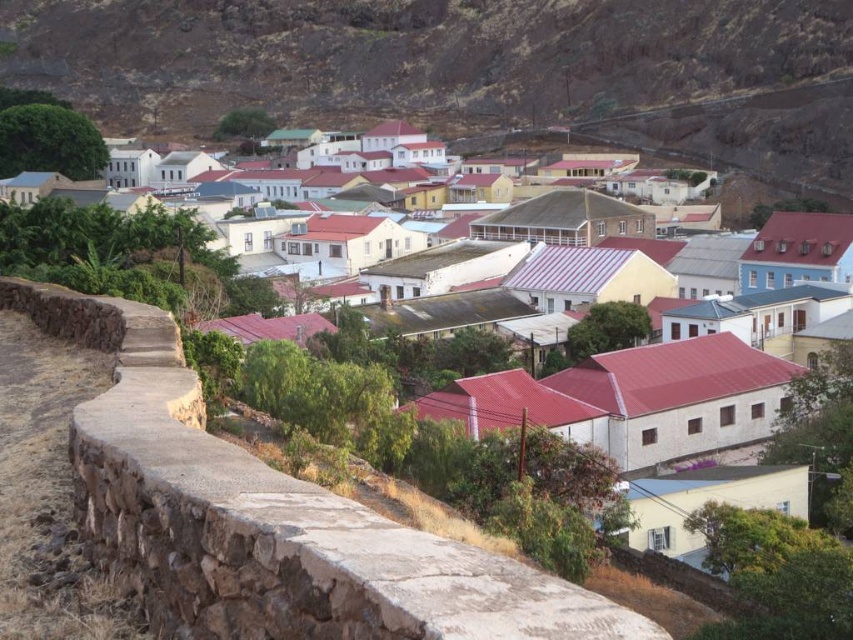
You are an architect planning to build a new structure in the village. You want to ensure it aligns with the existing structures in terms of scale. Given that you have a design for a small garden shed, which of the two objects, the white stone houses at center or the brown stone ledge at lower left, should you use as a reference for the shed to maintain proportional harmony?

The white stone houses at center have a larger width than the brown stone ledge at lower left. To maintain proportional harmony, the small garden shed should be scaled similarly to the brown stone ledge at lower left since it is smaller in width.